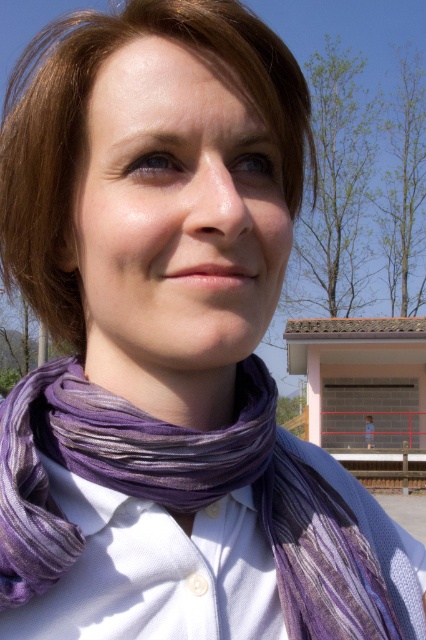
Which is below, brownhair at upper left or purple fabric at center?

purple fabric at center is lower down.

Does brownhair at upper left appear over purple fabric at center?

Yes.

This screenshot has height=640, width=426. What are the coordinates of `brownhair at upper left` in the screenshot? It's located at (83, 128).

Is purple striped scarf at center thinner than brownhair at upper left?

Indeed, purple striped scarf at center has a lesser width compared to brownhair at upper left.

Is purple striped scarf at center to the left of brownhair at upper left from the viewer's perspective?

No, purple striped scarf at center is not to the left of brownhair at upper left.

Between point (224, 609) and point (68, 140), which one is positioned in front?

Positioned in front is point (68, 140).

You are a GUI agent. You are given a task and a screenshot of the screen. Output one action in this format:
    pyautogui.click(x=<x>, y=<y>)
    Task: Click on the purple striped scarf at center
    
    Given the screenshot: What is the action you would take?
    pyautogui.click(x=184, y=513)

Is purple fabric at center shorter than purple woven scarf at center?

Indeed, purple fabric at center has a lesser height compared to purple woven scarf at center.

Locate an element on the screen. The image size is (426, 640). purple fabric at center is located at coordinates (164, 360).

What do you see at coordinates (164, 360) in the screenshot? This screenshot has height=640, width=426. I see `purple fabric at center` at bounding box center [164, 360].

Find the location of a particular element. purple fabric at center is located at coordinates point(164,360).